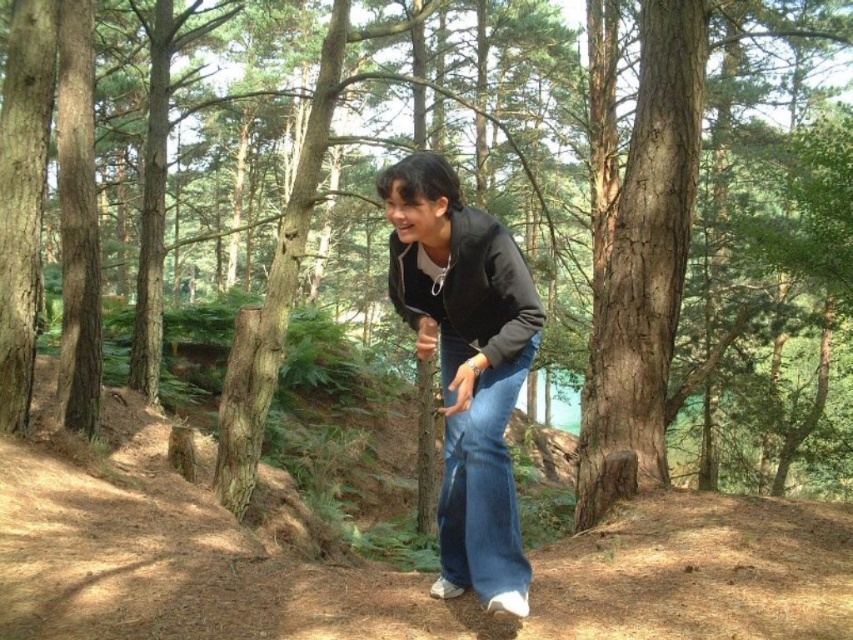
Question: From the image, what is the correct spatial relationship of matte black jacket at center in relation to denim at center?

Choices:
 (A) above
 (B) below

Answer: (A)

Question: Is matte black jacket at center to the left of denim at center from the viewer's perspective?

Choices:
 (A) yes
 (B) no

Answer: (A)

Question: Which point is closer to the camera taking this photo?

Choices:
 (A) (529, 364)
 (B) (445, 580)

Answer: (A)

Question: Can you confirm if matte black jacket at center is positioned above denim at center?

Choices:
 (A) yes
 (B) no

Answer: (A)